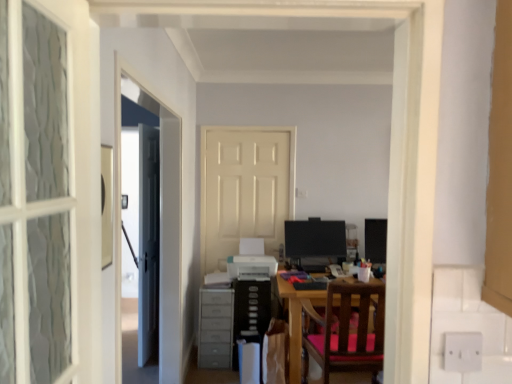
Question: Considering the relative sizes of gray plastic dresser at lower left and matte black monitor at center, placed as the 2th computer monitor when sorted from right to left, in the image provided, is gray plastic dresser at lower left smaller than matte black monitor at center, placed as the 2th computer monitor when sorted from right to left,?

Choices:
 (A) yes
 (B) no

Answer: (B)

Question: Considering the relative sizes of gray plastic dresser at lower left and matte black monitor at center, placed as the 2th computer monitor when sorted from right to left, in the image provided, is gray plastic dresser at lower left bigger than matte black monitor at center, placed as the 2th computer monitor when sorted from right to left,?

Choices:
 (A) no
 (B) yes

Answer: (B)

Question: Does gray plastic dresser at lower left appear on the left side of matte black monitor at center, placed as the 2th computer monitor when sorted from right to left?

Choices:
 (A) yes
 (B) no

Answer: (A)

Question: Is gray plastic dresser at lower left not within matte black monitor at center, placed as the 2th computer monitor when sorted from right to left?

Choices:
 (A) yes
 (B) no

Answer: (A)

Question: Considering the relative positions of gray plastic dresser at lower left and matte black monitor at center, arranged as the first computer monitor when viewed from the left, in the image provided, is gray plastic dresser at lower left to the right of matte black monitor at center, arranged as the first computer monitor when viewed from the left, from the viewer's perspective?

Choices:
 (A) yes
 (B) no

Answer: (B)

Question: Considering the relative positions of gray plastic dresser at lower left and matte black monitor at center, arranged as the first computer monitor when viewed from the left, in the image provided, is gray plastic dresser at lower left to the left or to the right of matte black monitor at center, arranged as the first computer monitor when viewed from the left,?

Choices:
 (A) left
 (B) right

Answer: (A)

Question: Choose the correct answer: Is gray plastic dresser at lower left inside matte black monitor at center, placed as the 2th computer monitor when sorted from right to left, or outside it?

Choices:
 (A) outside
 (B) inside

Answer: (A)

Question: Is gray plastic dresser at lower left wider or thinner than matte black monitor at center, placed as the 2th computer monitor when sorted from right to left?

Choices:
 (A) wide
 (B) thin

Answer: (A)

Question: Considering the positions of gray plastic dresser at lower left and matte black monitor at center, placed as the 2th computer monitor when sorted from right to left, in the image, is gray plastic dresser at lower left bigger or smaller than matte black monitor at center, placed as the 2th computer monitor when sorted from right to left,?

Choices:
 (A) big
 (B) small

Answer: (A)

Question: Is matte black monitor at center, placed as the 2th computer monitor when sorted from right to left, bigger or smaller than wooden chair with pink cushion at center?

Choices:
 (A) small
 (B) big

Answer: (A)

Question: Is matte black monitor at center, arranged as the first computer monitor when viewed from the left, situated inside wooden chair with pink cushion at center or outside?

Choices:
 (A) outside
 (B) inside

Answer: (A)

Question: From the image's perspective, is matte black monitor at center, placed as the 2th computer monitor when sorted from right to left, located above or below wooden chair with pink cushion at center?

Choices:
 (A) below
 (B) above

Answer: (B)

Question: Is matte black monitor at center, arranged as the first computer monitor when viewed from the left, to the left or to the right of wooden chair with pink cushion at center in the image?

Choices:
 (A) left
 (B) right

Answer: (A)

Question: Would you say wooden chair with pink cushion at center is to the left or to the right of matte black monitor at right, placed as the second computer monitor when sorted from left to right, in the picture?

Choices:
 (A) right
 (B) left

Answer: (B)

Question: Considering the positions of wooden chair with pink cushion at center and matte black monitor at right, placed as the second computer monitor when sorted from left to right, in the image, is wooden chair with pink cushion at center bigger or smaller than matte black monitor at right, placed as the second computer monitor when sorted from left to right,?

Choices:
 (A) small
 (B) big

Answer: (B)